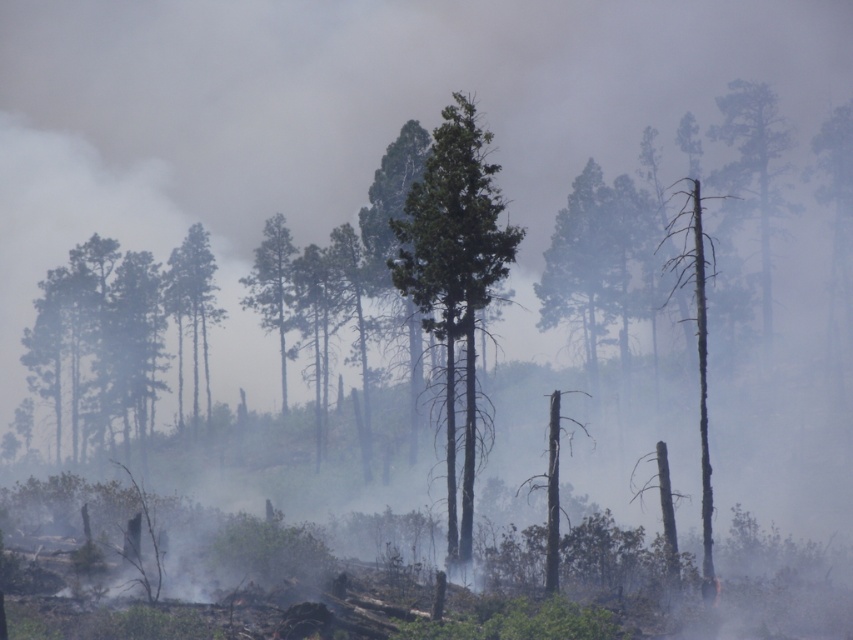
Question: Is charred wood tree trunk at right in front of green textured tree at center?

Choices:
 (A) yes
 (B) no

Answer: (A)

Question: Which object is positioned closest to the green rough bark tree at center?

Choices:
 (A) charred wood tree trunk at right
 (B) green bark tree at right

Answer: (A)

Question: Which object is closer to the camera taking this photo?

Choices:
 (A) green bark tree at right
 (B) charred wood tree trunk at right

Answer: (B)

Question: Does green rough bark tree at center appear over green bark tree at right?

Choices:
 (A) no
 (B) yes

Answer: (A)

Question: Among these objects, which one is farthest from the camera?

Choices:
 (A) green rough bark tree at center
 (B) green textured tree at center
 (C) charred wood tree trunk at right
 (D) green bark tree at right

Answer: (B)

Question: Does green bark tree at right appear on the right side of green textured tree at center?

Choices:
 (A) yes
 (B) no

Answer: (A)